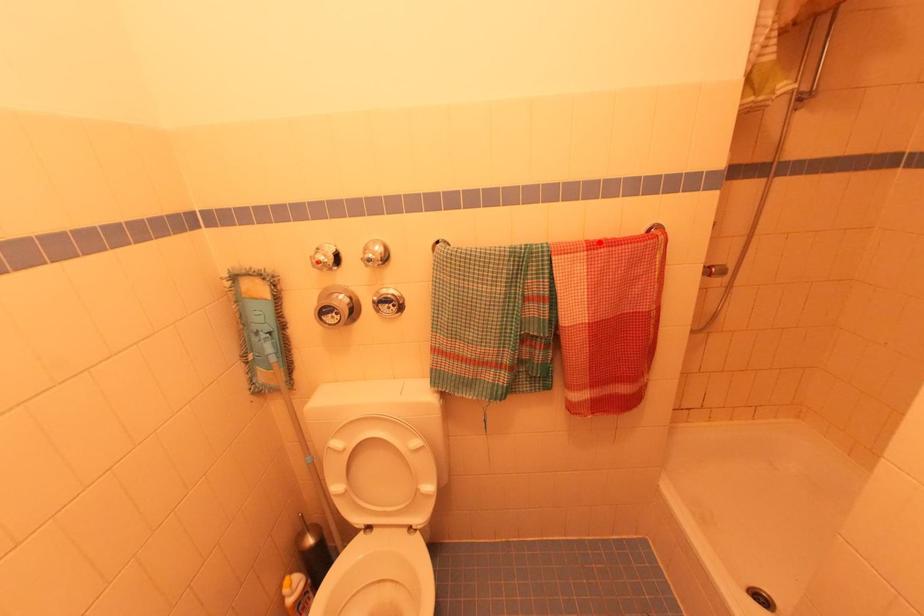
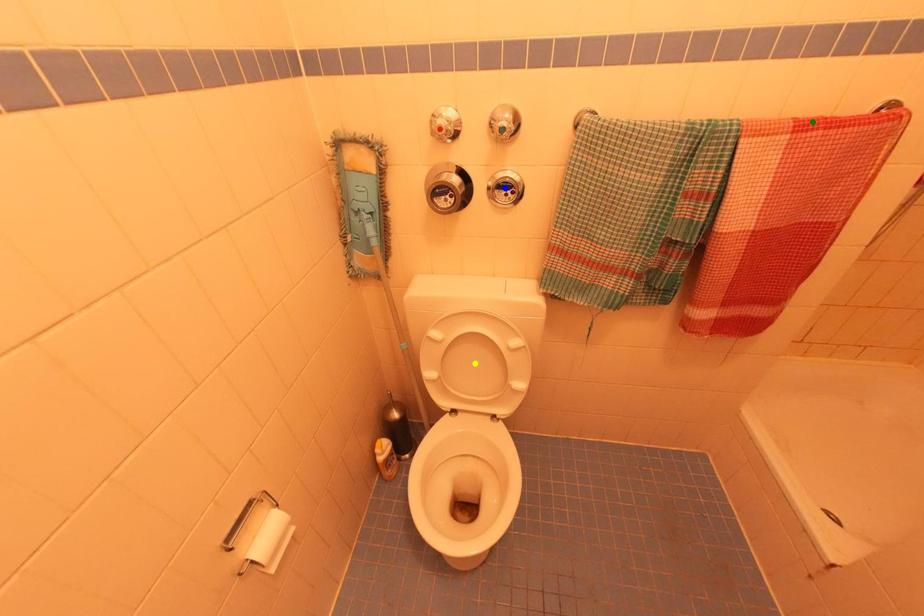
Question: I am providing you with two images of the same scene from different viewpoints. A red point is marked on the first image. You are given multiple points on the second image. Which point in image 2 is actually the same real-world point as the red point in image 1?

Choices:
 (A) green point
 (B) blue point
 (C) yellow point

Answer: (A)